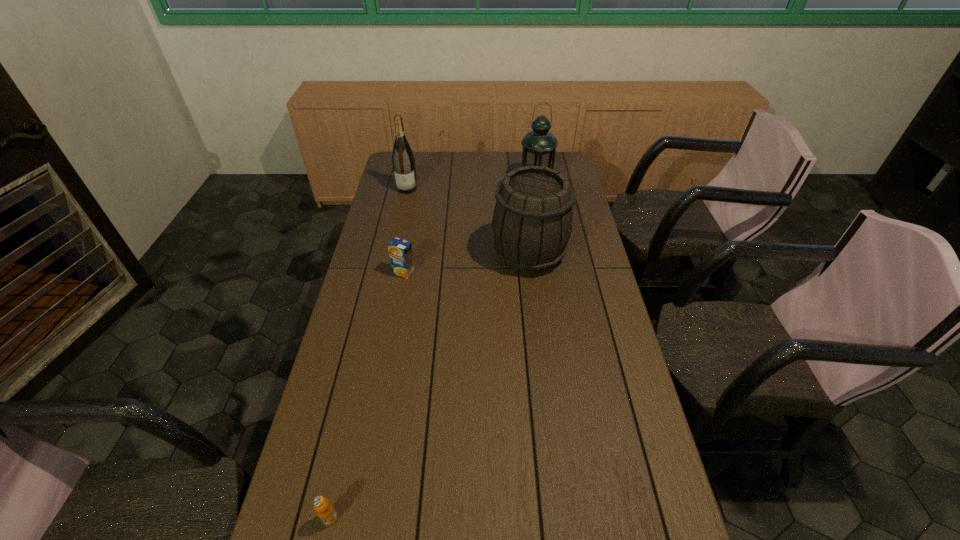
Where is `vacant area between the wine bottle and the wine bucket`? This screenshot has height=540, width=960. vacant area between the wine bottle and the wine bucket is located at coordinates (468, 221).

Locate an element on the screen. The width and height of the screenshot is (960, 540). blank region between the wine bottle and the wine bucket is located at coordinates (468, 221).

The height and width of the screenshot is (540, 960). I want to click on vacant region between the fourth tallest object and the left orange juice, so click(x=367, y=395).

This screenshot has width=960, height=540. I want to click on object that is the fourth closest to the fourth tallest object, so click(325, 511).

Select which object is the second closest to the taller orange juice. Please provide its 2D coordinates. Your answer should be formatted as a tuple, i.e. [(x, y)], where the tuple contains the x and y coordinates of a point satisfying the conditions above.

[(403, 161)]

The height and width of the screenshot is (540, 960). What are the coordinates of `vacant space that satisfies the following two spatial constraints: 1. on the label of the right orange juice; 2. on the right side of the wine bottle` in the screenshot? It's located at (389, 273).

Locate an element on the screen. This screenshot has height=540, width=960. vacant space that satisfies the following two spatial constraints: 1. on the label of the fourth tallest object; 2. on the right side of the wine bottle is located at coordinates (389, 273).

At what (x,y) coordinates should I click in order to perform the action: click on free space that satisfies the following two spatial constraints: 1. on the label of the second shortest object; 2. on the left side of the wine bottle. Please return your answer as a coordinate pair (x, y). The height and width of the screenshot is (540, 960). Looking at the image, I should click on (389, 273).